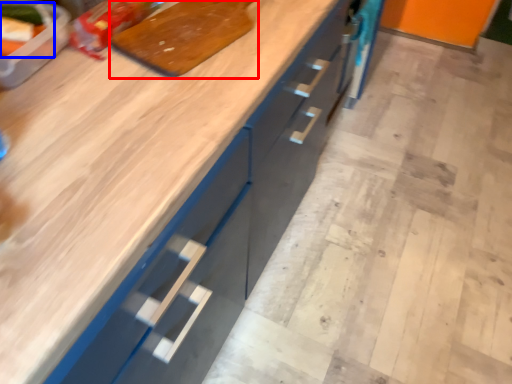
Question: Which of the following is the closest to the observer, cutting board (highlighted by a red box) or food (highlighted by a blue box)?

Choices:
 (A) cutting board
 (B) food

Answer: (B)